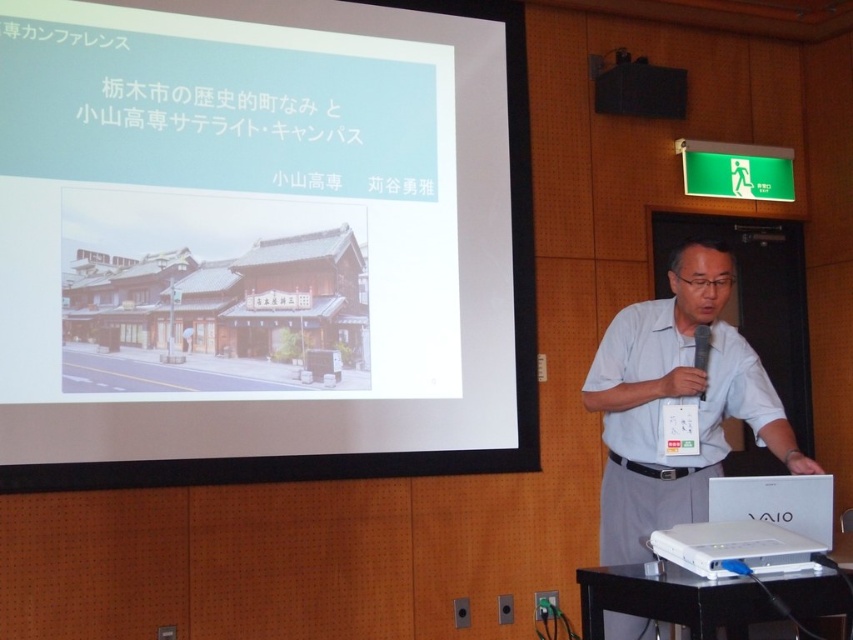
You are an attendee in the conference room and notice the white matte shirt at center and the black plastic podium at lower right. Which object is taller?

The white matte shirt at center is much taller than the black plastic podium at lower right.

You are setting up for a presentation and need to ensure the white plastic projector at lower right can project onto the white matte projection screen at upper center. Based on their heights, will the projected image be visible on the screen?

The white matte projection screen at upper center has a greater height compared to the white plastic projector at lower right, so the projected image will be visible on the screen as the screen is taller than the projector.

You are standing in a conference room and want to present using the white matte projection screen at upper center. If your height is 1.7 meters and you need to reach the top of the screen to adjust the projector, will you be able to do so without a ladder?

The white matte projection screen at upper center is 3.34 meters away from the viewer. Since the distance is horizontal, your height of 1.7 meters does not directly determine vertical reach. You would need to consider your vertical reach, which typically extends about 0.3 meters above your height. Without knowing your vertical reach, it is uncertain, but the distance alone does not prevent you from reaching the screen if you can physically extend your arms upwards.